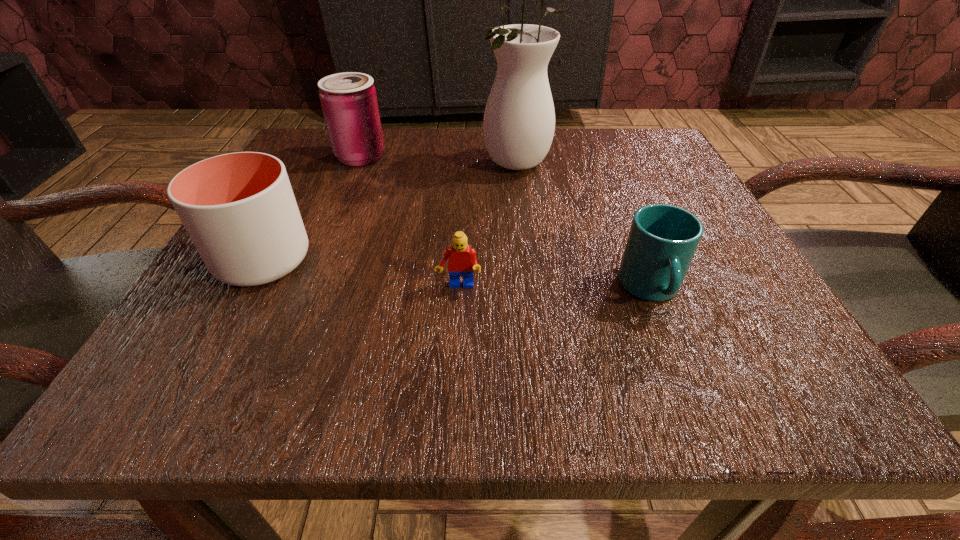
Identify the location of vase. (519, 120).

What are the coordinates of `the tallest object` in the screenshot? It's located at (519, 120).

Identify the location of can. The image size is (960, 540). (349, 102).

This screenshot has width=960, height=540. Identify the location of the taller cup. (239, 209).

I want to click on the rightmost object, so click(x=662, y=241).

Identify the location of the shorter cup. (662, 241).

The image size is (960, 540). What are the coordinates of `the shortest object` in the screenshot? It's located at (462, 261).

Locate an element on the screen. This screenshot has width=960, height=540. Lego is located at coordinates (462, 261).

Identify the location of vacant space located on the left of the tallest object. Image resolution: width=960 pixels, height=540 pixels. (374, 165).

Identify the location of blank area located on the back of the can. This screenshot has height=540, width=960. (371, 132).